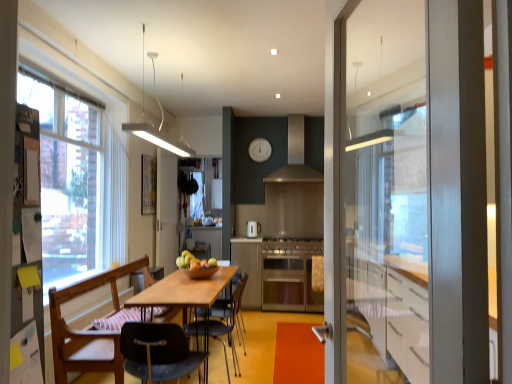
Question: Can you confirm if black plastic chair at center, the third chair viewed from the back, is positioned to the right of stainless steel stove at center?

Choices:
 (A) yes
 (B) no

Answer: (B)

Question: From a real-world perspective, does black plastic chair at center, the third chair viewed from the back, sit lower than stainless steel stove at center?

Choices:
 (A) yes
 (B) no

Answer: (A)

Question: Considering the relative sizes of black plastic chair at center, the third chair viewed from the back, and stainless steel stove at center in the image provided, is black plastic chair at center, the third chair viewed from the back, thinner than stainless steel stove at center?

Choices:
 (A) yes
 (B) no

Answer: (A)

Question: Is black plastic chair at center, the first chair when ordered from front to back, looking in the opposite direction of stainless steel stove at center?

Choices:
 (A) no
 (B) yes

Answer: (A)

Question: Is the depth of black plastic chair at center, the first chair when ordered from front to back, greater than that of stainless steel stove at center?

Choices:
 (A) yes
 (B) no

Answer: (B)

Question: From a real-world perspective, is black plastic chair at center, the third chair viewed from the back, above or below satin silver oven at center?

Choices:
 (A) above
 (B) below

Answer: (A)

Question: Considering the positions of black plastic chair at center, the first chair when ordered from front to back, and satin silver oven at center in the image, is black plastic chair at center, the first chair when ordered from front to back, bigger or smaller than satin silver oven at center?

Choices:
 (A) small
 (B) big

Answer: (A)

Question: Looking at their shapes, would you say black plastic chair at center, the third chair viewed from the back, is wider or thinner than satin silver oven at center?

Choices:
 (A) thin
 (B) wide

Answer: (A)

Question: Relative to satin silver oven at center, is black plastic chair at center, the first chair when ordered from front to back, in front or behind?

Choices:
 (A) behind
 (B) front

Answer: (B)

Question: Is point (53, 362) positioned closer to the camera than point (259, 150)?

Choices:
 (A) closer
 (B) farther

Answer: (A)

Question: From the image's perspective, is wooden chair at left, which appears as the 2th chair when viewed from the front, positioned above or below white matte clock at upper center?

Choices:
 (A) above
 (B) below

Answer: (B)

Question: Considering the positions of wooden chair at left, marked as the 2th chair in a back-to-front arrangement, and white matte clock at upper center in the image, is wooden chair at left, marked as the 2th chair in a back-to-front arrangement, taller or shorter than white matte clock at upper center?

Choices:
 (A) short
 (B) tall

Answer: (B)

Question: From a real-world perspective, is wooden chair at left, marked as the 2th chair in a back-to-front arrangement, above or below white matte clock at upper center?

Choices:
 (A) below
 (B) above

Answer: (A)

Question: In terms of height, does wooden chair at left, marked as the 2th chair in a back-to-front arrangement, look taller or shorter compared to wooden table at center?

Choices:
 (A) short
 (B) tall

Answer: (B)

Question: Does point (95, 365) appear closer or farther from the camera than point (190, 292)?

Choices:
 (A) farther
 (B) closer

Answer: (B)